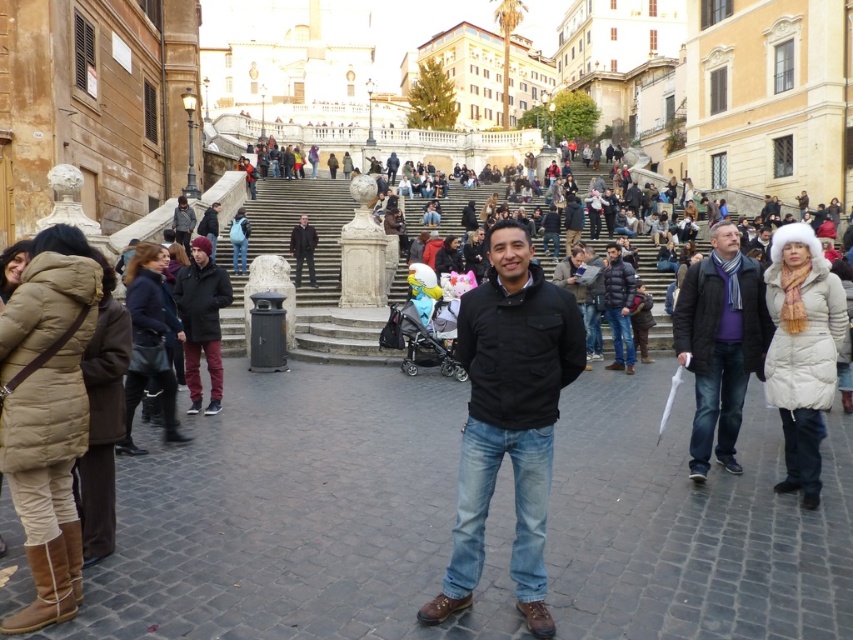
You are standing in the public square and want to take a photo that includes both the man in the foreground and the people on the upper staircase. Which of the two points, point (728,285) or point (625,280), is closer to you to ensure both subjects are in focus?

Point (728,285) is closer to the viewer than point (625,280), so focusing on that point will help keep both the man in the foreground and the people on the upper staircase in focus.

You are a fashion designer observing the scene and want to know which item of clothing is bigger between the blue wool scarf at right and the black leather jacket at upper center. Could you determine this based on their sizes?

The blue wool scarf at right is larger in size than the black leather jacket at upper center, so the scarf is bigger.